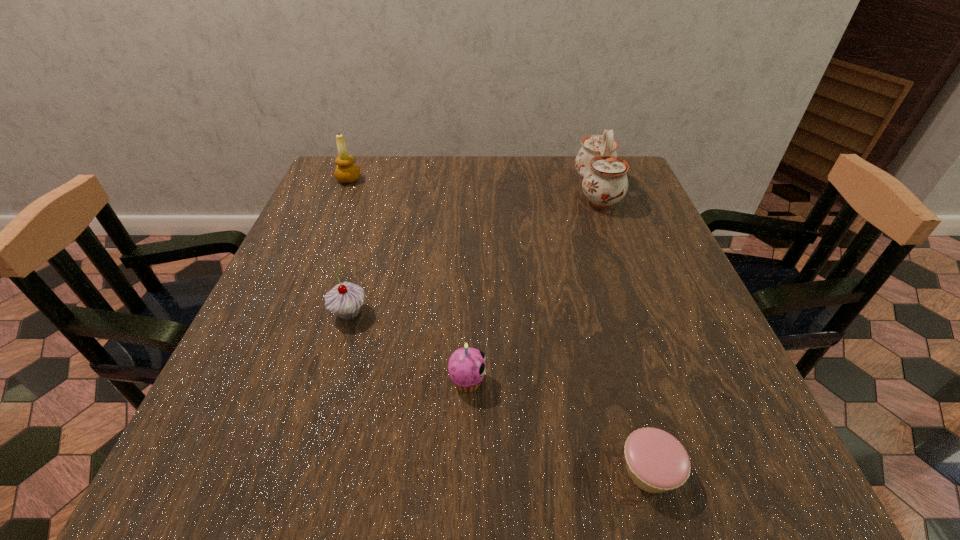
At what (x,y) coordinates should I click in order to perform the action: click on chinaware. Please return your answer as a coordinate pair (x, y). Looking at the image, I should click on (605, 182).

Image resolution: width=960 pixels, height=540 pixels. Find the location of `the leftmost object`. the leftmost object is located at coordinates (346, 172).

The height and width of the screenshot is (540, 960). What are the coordinates of `the second object from left to right` in the screenshot? It's located at (345, 299).

Locate an element on the screen. the farthest cupcake is located at coordinates pyautogui.click(x=345, y=299).

At what (x,y) coordinates should I click in order to perform the action: click on the second nearest cupcake. Please return your answer as a coordinate pair (x, y). This screenshot has width=960, height=540. Looking at the image, I should click on (466, 367).

Locate an element on the screen. the third object from right to left is located at coordinates (466, 367).

The height and width of the screenshot is (540, 960). In order to click on the nearest object in this screenshot , I will do `click(656, 461)`.

Where is `the rightmost cupcake`? Image resolution: width=960 pixels, height=540 pixels. the rightmost cupcake is located at coordinates pyautogui.click(x=656, y=461).

Identify the location of free spot located 0.180m by the handle of the chinaware. (509, 191).

The height and width of the screenshot is (540, 960). In order to click on vacant area situated by the handle of the chinaware in this screenshot , I will do `click(531, 191)`.